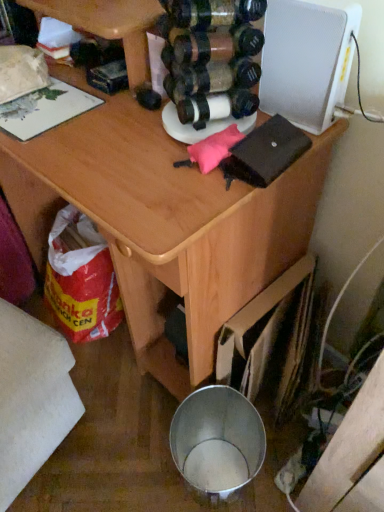
Question: In terms of height, does wooden desk at center look taller or shorter compared to white textured speaker at upper right?

Choices:
 (A) tall
 (B) short

Answer: (A)

Question: Would you say wooden desk at center is inside or outside white textured speaker at upper right?

Choices:
 (A) outside
 (B) inside

Answer: (A)

Question: From the image's perspective, is wooden desk at center located above or below white textured speaker at upper right?

Choices:
 (A) above
 (B) below

Answer: (B)

Question: Is point (289, 52) closer or farther from the camera than point (117, 138)?

Choices:
 (A) closer
 (B) farther

Answer: (A)

Question: Considering the positions of white textured speaker at upper right and wooden desk at center in the image, is white textured speaker at upper right bigger or smaller than wooden desk at center?

Choices:
 (A) big
 (B) small

Answer: (B)

Question: From the image's perspective, is white textured speaker at upper right positioned above or below wooden desk at center?

Choices:
 (A) below
 (B) above

Answer: (B)

Question: Looking at their shapes, would you say white textured speaker at upper right is wider or thinner than wooden desk at center?

Choices:
 (A) wide
 (B) thin

Answer: (B)